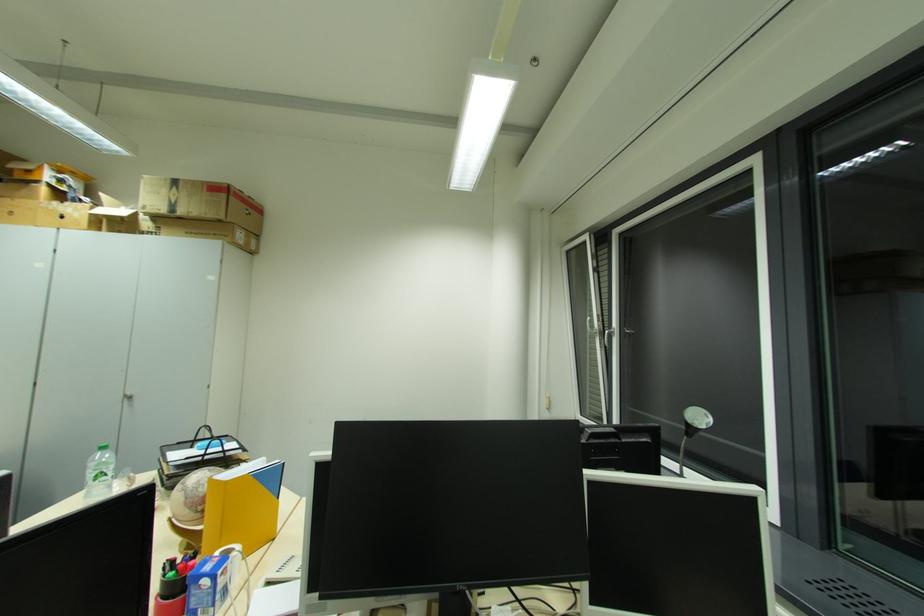
Which object does [200,201] point to?

It corresponds to the cardboard box in the image.